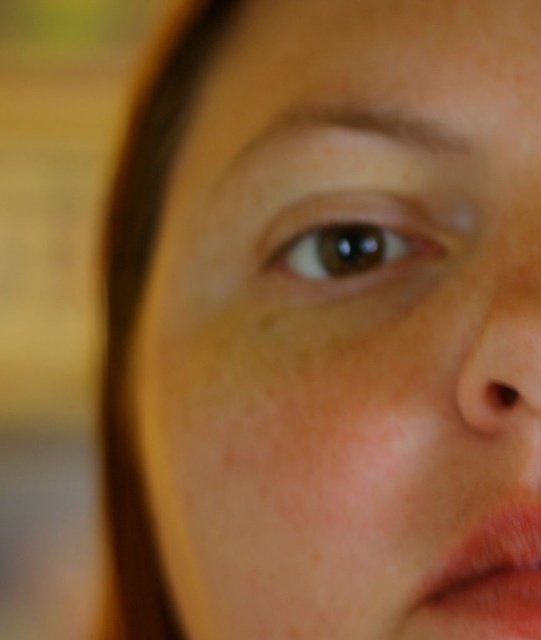
You are a makeup artist preparing to apply lipstick. You observe the person in the image and notice the pink matte lips at lower right and the smooth skin nose at right. Which feature has a larger size?

The pink matte lips at lower right is bigger than the smooth skin nose at right.

You are a makeup artist preparing to apply lipstick. You observe the person in the image and notice the pink matte lips at lower right and the smooth skin nose at right. Based on their relative sizes, which one do you think is wider?

The pink matte lips at lower right might be wider than smooth skin nose at right according to the description.